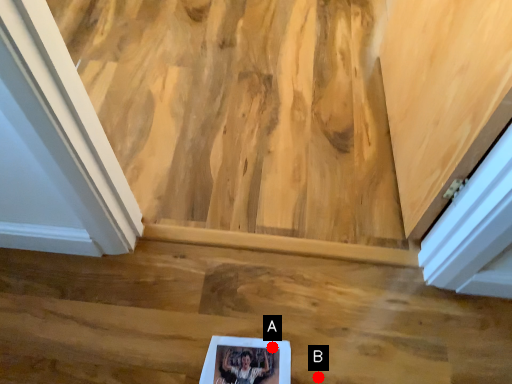
Question: Two points are circled on the image, labeled by A and B beside each circle. Which point is further to the camera?

Choices:
 (A) A is further
 (B) B is further

Answer: (A)